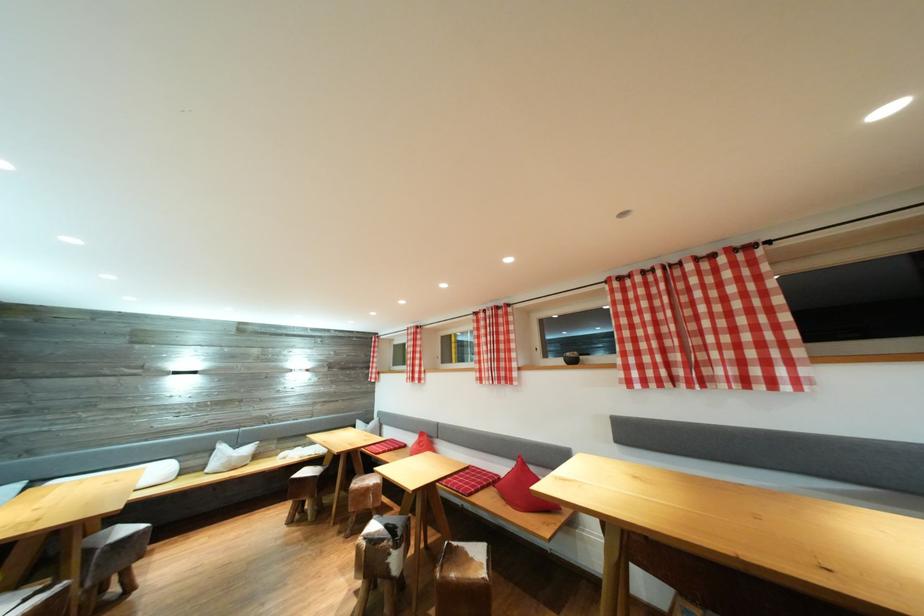
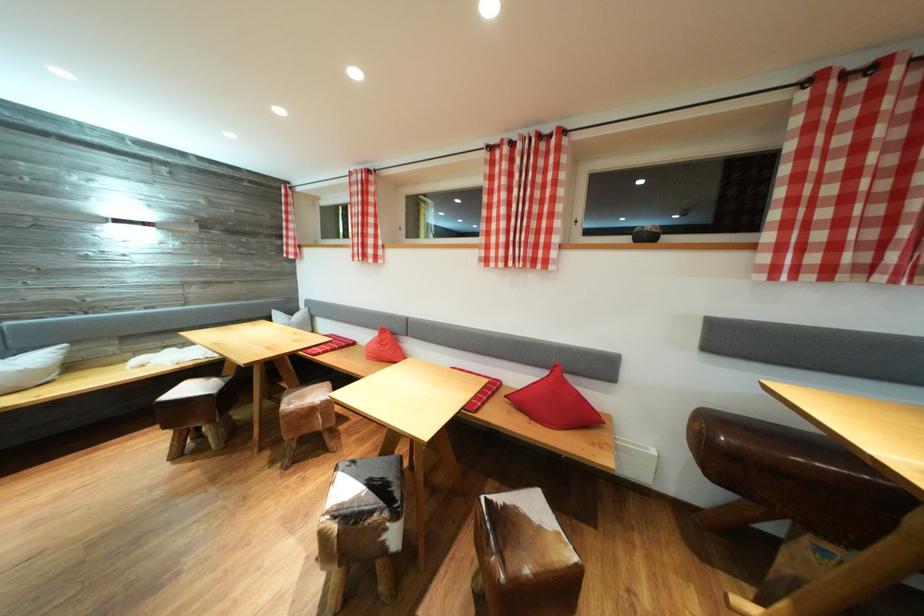
Find the pixel in the second image that matches [244,451] in the first image.

(14, 358)